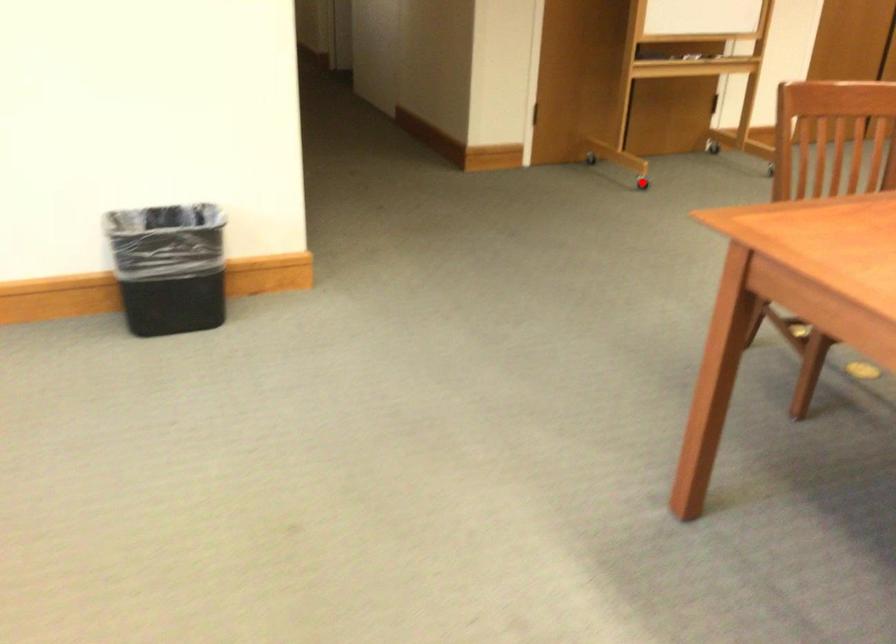
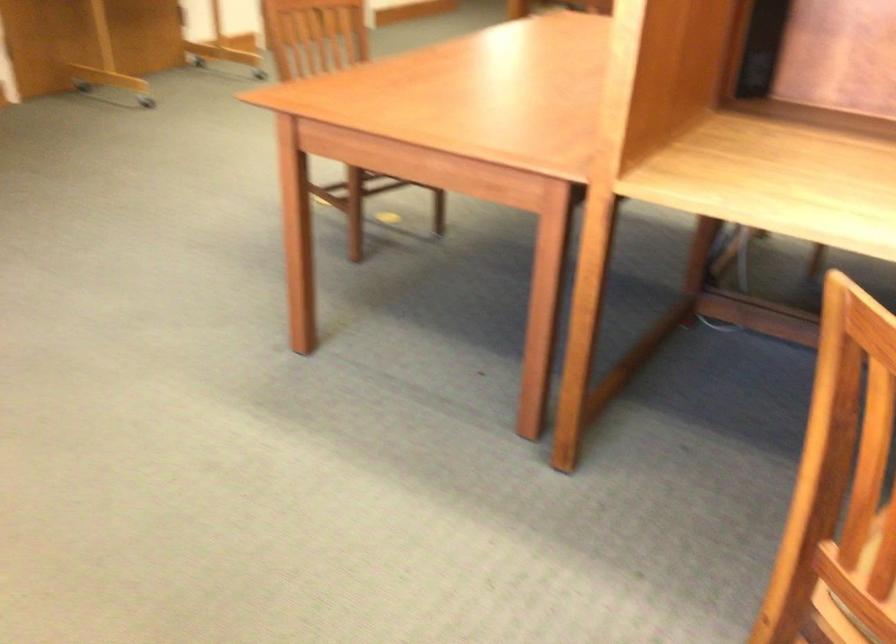
Question: I am providing you with two images of the same scene from different viewpoints. A red point is marked on the first image. Is the red point's position out of view in image 2?

Choices:
 (A) Yes
 (B) No

Answer: (A)